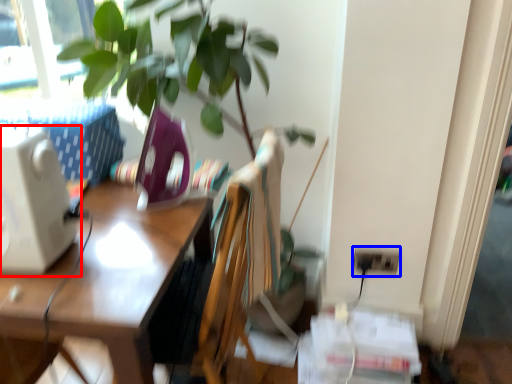
Question: Which object is closer to the camera taking this photo, desktop computer (highlighted by a red box) or electric outlet (highlighted by a blue box)?

Choices:
 (A) desktop computer
 (B) electric outlet

Answer: (A)